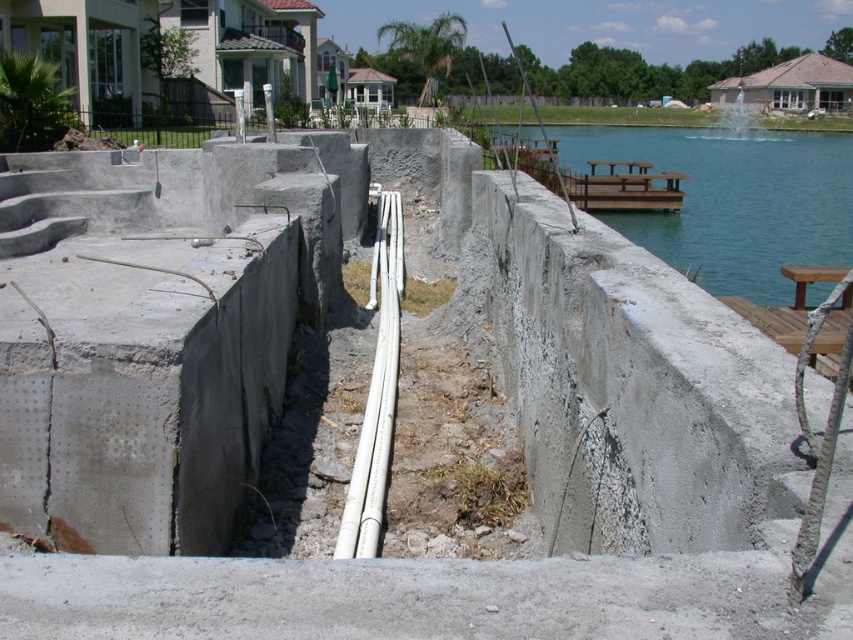
Question: Is white plastic pipes at center below brown wooden dock at right?

Choices:
 (A) yes
 (B) no

Answer: (A)

Question: Among these objects, which one is farthest from the camera?

Choices:
 (A) brown wooden dock at center
 (B) blue water at upper right

Answer: (A)

Question: Is brown wooden dock at center to the right of brown wooden dock at right from the viewer's perspective?

Choices:
 (A) no
 (B) yes

Answer: (B)

Question: Which of the following is the farthest from the observer?

Choices:
 (A) brown wooden dock at right
 (B) blue water at upper right
 (C) brown wooden dock at center
 (D) white plastic pipes at center

Answer: (C)

Question: Does blue water at upper right appear on the right side of brown wooden dock at center?

Choices:
 (A) no
 (B) yes

Answer: (B)

Question: Which point appears closest to the camera in this image?

Choices:
 (A) (685, 157)
 (B) (799, 282)
 (C) (630, 202)
 (D) (374, 380)

Answer: (D)